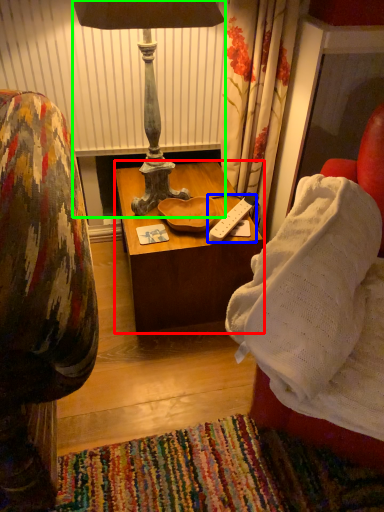
Question: Which object is the farthest from table (highlighted by a red box)? Choose among these: remote (highlighted by a blue box) or lamp (highlighted by a green box).

Choices:
 (A) remote
 (B) lamp

Answer: (B)